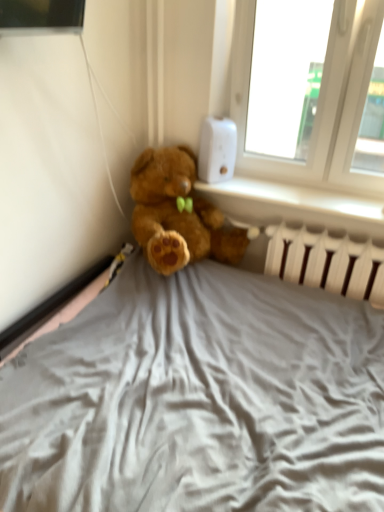
Question: From a real-world perspective, is white plastic thermostat at upper right above or below white plastic radiator at lower right?

Choices:
 (A) below
 (B) above

Answer: (B)

Question: Does point (205, 159) appear closer or farther from the camera than point (370, 270)?

Choices:
 (A) closer
 (B) farther

Answer: (B)

Question: Which of these objects is positioned closest to the white plastic thermostat at upper right?

Choices:
 (A) white plastic radiator at lower right
 (B) white plastic radiator at lower right

Answer: (A)

Question: Estimate the real-world distances between objects in this image. Which object is farther from the white plastic thermostat at upper right?

Choices:
 (A) white plastic radiator at lower right
 (B) white plastic radiator at lower right

Answer: (B)